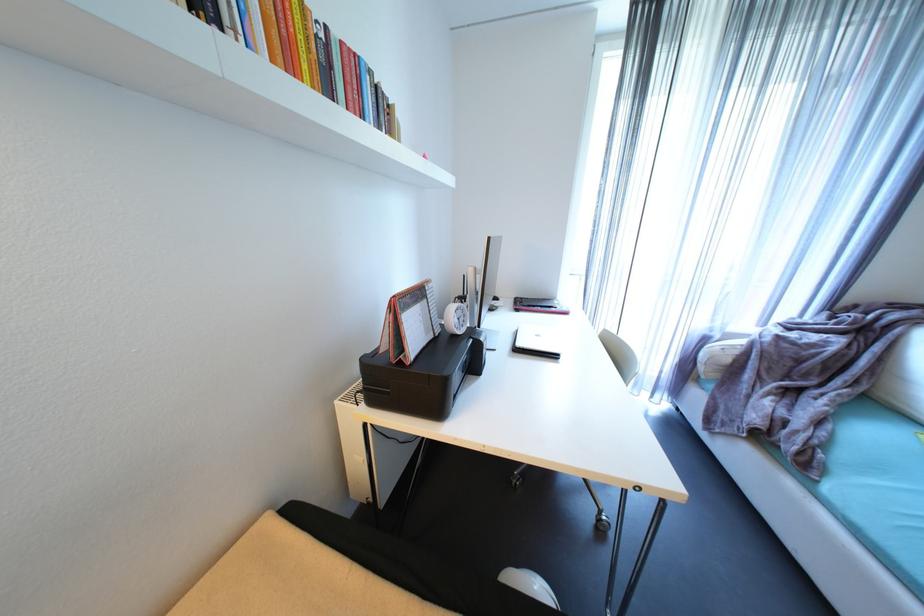
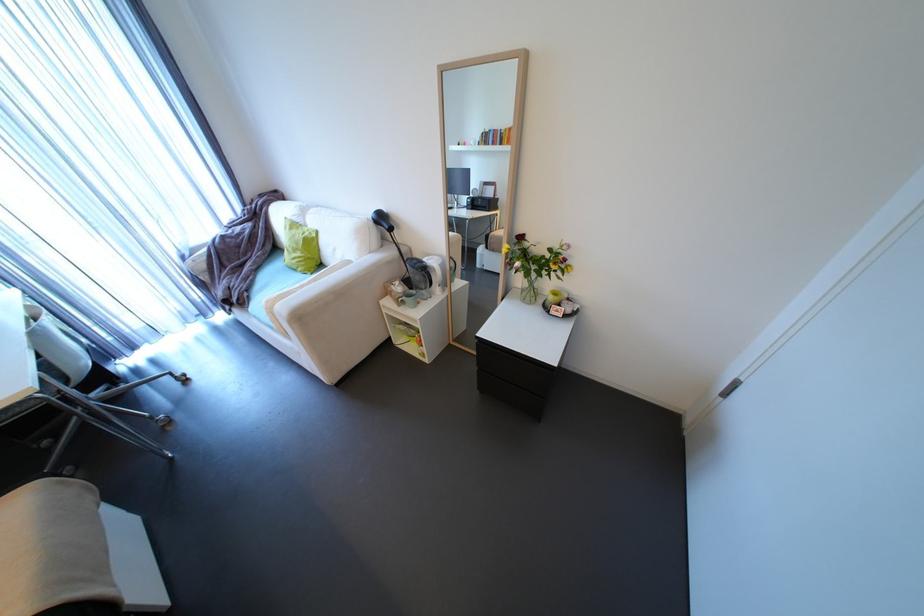
In the second image, find the point that corresponds to [723,338] in the first image.

(195, 254)